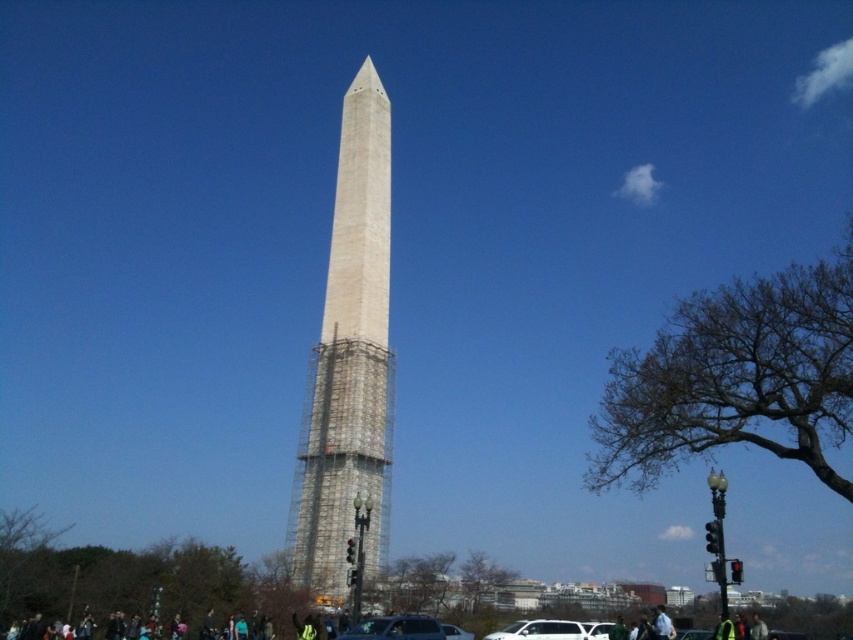
Question: Which object is positioned farthest from the silver metallic car at center?

Choices:
 (A) metallic silver car at center
 (B) white marble tower at center

Answer: (B)

Question: Which of these objects is positioned closest to the silver metallic car at center?

Choices:
 (A) metallic silver car at center
 (B) white matte car at center
 (C) white marble tower at center

Answer: (B)

Question: Does white marble tower at center appear on the left side of silver metallic car at center?

Choices:
 (A) yes
 (B) no

Answer: (A)

Question: Which point is farther to the camera?

Choices:
 (A) white matte car at center
 (B) metallic silver car at center

Answer: (A)

Question: Is white marble tower at center wider than metallic silver car at center?

Choices:
 (A) yes
 (B) no

Answer: (A)

Question: Can you confirm if white matte car at center is positioned below silver metallic car at center?

Choices:
 (A) no
 (B) yes

Answer: (B)